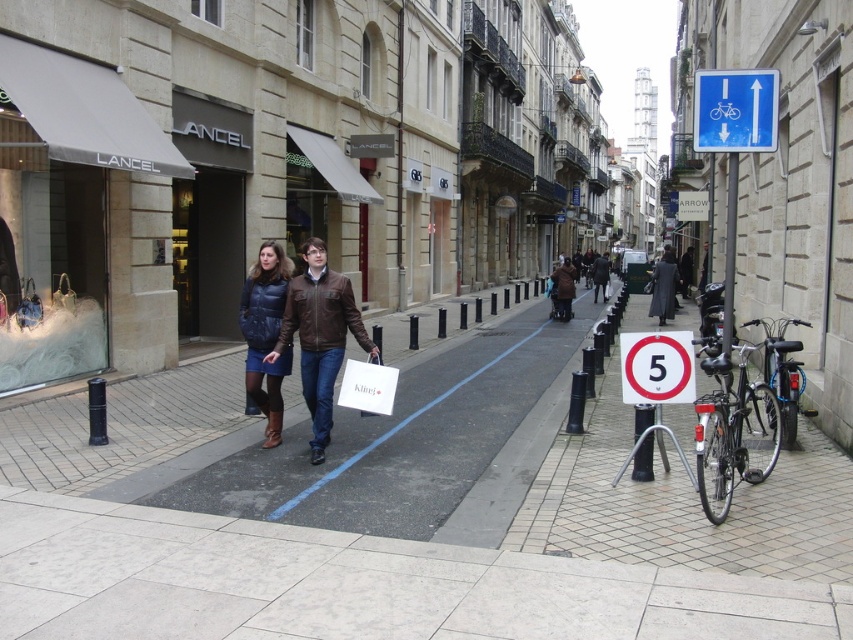
You are a tourist walking down the street and notice the white plastic sign at center and the brown leather jacket at center. According to their positions, which item is located to the left?

The white plastic sign at center is positioned on the left side of brown leather jacket at center, so the white plastic sign at center is on the left.

You are standing on the pedestrian path in the middle of the street. There are two points marked on the ground ahead of you. One is at coordinates point (x=737, y=113) and the other is at point (x=605, y=294). Which point is closer to you?

Point (x=737, y=113) is closer to the viewer than point (x=605, y=294).